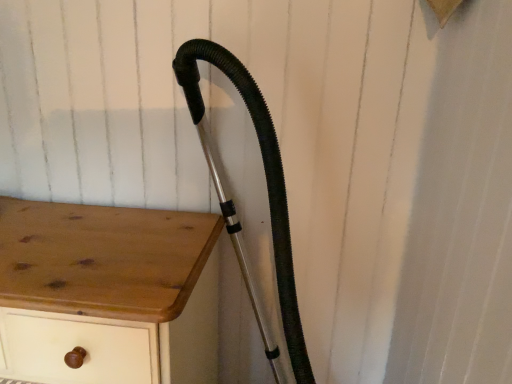
Image resolution: width=512 pixels, height=384 pixels. Describe the element at coordinates (108, 293) in the screenshot. I see `wooden chest of drawers at center` at that location.

This screenshot has height=384, width=512. What are the coordinates of `wooden chest of drawers at center` in the screenshot? It's located at (108, 293).

Measure the distance between point [148,346] and camera.

A distance of 29.17 inches exists between point [148,346] and camera.

In order to face wooden chest of drawers at center, should I rotate leftwards or rightwards?

Turn left approximately 25.290 degrees to face it.

Identify the location of wooden chest of drawers at center. Image resolution: width=512 pixels, height=384 pixels. (108, 293).